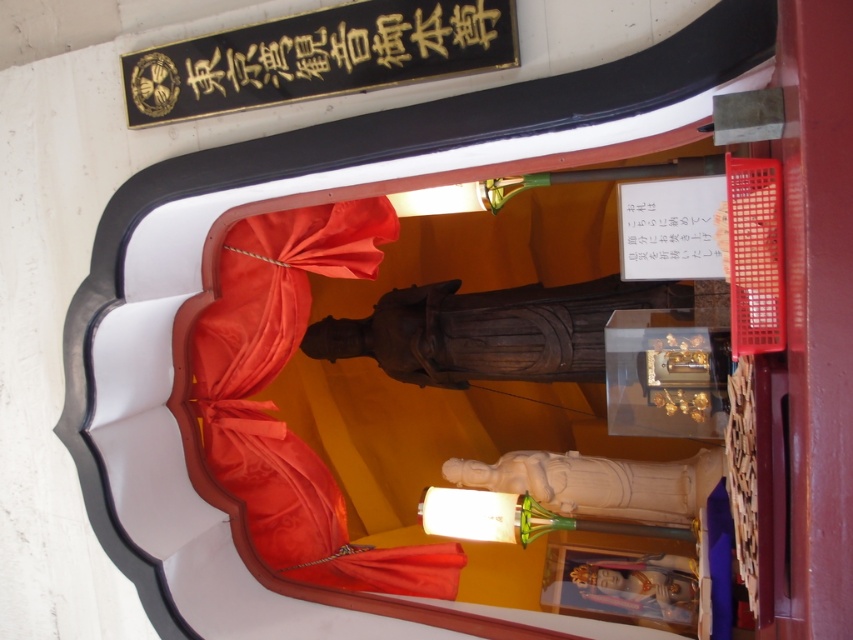
You are standing in the temple and want to place a small offering at the base of the shrine. The offering must be placed between the two points labeled point [340,250] and point [396,6]. Given that you can only move forward in a straight line from your current position, which point should you aim for to ensure the offering lands between them?

You should aim for point [396,6] because point [340,250] is behind it, so moving forward towards the closer point will place the offering between them.